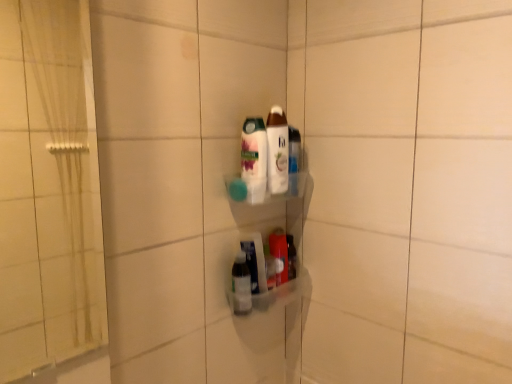
Question: Which direction should I rotate to look at translucent plastic bottle at lower center, the 3th bottle in the top-to-bottom sequence?

Choices:
 (A) right
 (B) left

Answer: (A)

Question: Is white glossy lotion at center, arranged as the 1th bottle when viewed from the top, to the right of white glossy bottle at center, positioned as the third bottle in bottom-to-top order, from the viewer's perspective?

Choices:
 (A) no
 (B) yes

Answer: (B)

Question: From the image's perspective, is white glossy lotion at center, the 4th bottle when ordered from bottom to top, beneath white glossy bottle at center, arranged as the second bottle when viewed from the top?

Choices:
 (A) yes
 (B) no

Answer: (B)

Question: Is white glossy lotion at center, arranged as the 1th bottle when viewed from the top, looking in the opposite direction of white glossy bottle at center, arranged as the second bottle when viewed from the top?

Choices:
 (A) no
 (B) yes

Answer: (A)

Question: From a real-world perspective, is white glossy lotion at center, arranged as the 1th bottle when viewed from the top, physically above white glossy bottle at center, arranged as the second bottle when viewed from the top?

Choices:
 (A) no
 (B) yes

Answer: (B)

Question: Is white glossy lotion at center, the 4th bottle when ordered from bottom to top, with white glossy bottle at center, positioned as the third bottle in bottom-to-top order?

Choices:
 (A) no
 (B) yes

Answer: (B)

Question: Considering the relative sizes of white glossy lotion at center, arranged as the 1th bottle when viewed from the top, and white glossy bottle at center, arranged as the second bottle when viewed from the top, in the image provided, is white glossy lotion at center, arranged as the 1th bottle when viewed from the top, bigger than white glossy bottle at center, arranged as the second bottle when viewed from the top,?

Choices:
 (A) no
 (B) yes

Answer: (A)

Question: Is translucent plastic bottle at center, the first bottle in the bottom-to-top sequence, taller than white glossy lotion at center, arranged as the 1th bottle when viewed from the top?

Choices:
 (A) yes
 (B) no

Answer: (B)

Question: From a real-world perspective, is translucent plastic bottle at center, which ranks as the 4th bottle in top-to-bottom order, over white glossy lotion at center, the 4th bottle when ordered from bottom to top?

Choices:
 (A) no
 (B) yes

Answer: (A)

Question: From the image's perspective, is translucent plastic bottle at center, which ranks as the 4th bottle in top-to-bottom order, on white glossy lotion at center, the 4th bottle when ordered from bottom to top?

Choices:
 (A) no
 (B) yes

Answer: (A)

Question: Is translucent plastic bottle at center, the first bottle in the bottom-to-top sequence, further to the viewer compared to white glossy lotion at center, the 4th bottle when ordered from bottom to top?

Choices:
 (A) yes
 (B) no

Answer: (A)

Question: Is translucent plastic bottle at center, the first bottle in the bottom-to-top sequence, bigger than white glossy lotion at center, the 4th bottle when ordered from bottom to top?

Choices:
 (A) yes
 (B) no

Answer: (B)

Question: Is translucent plastic bottle at center, the first bottle in the bottom-to-top sequence, not near white glossy lotion at center, arranged as the 1th bottle when viewed from the top?

Choices:
 (A) no
 (B) yes

Answer: (A)

Question: From a real-world perspective, is white glossy bottle at center, arranged as the second bottle when viewed from the top, under translucent plastic bottle at lower center, the 3th bottle in the top-to-bottom sequence?

Choices:
 (A) no
 (B) yes

Answer: (A)